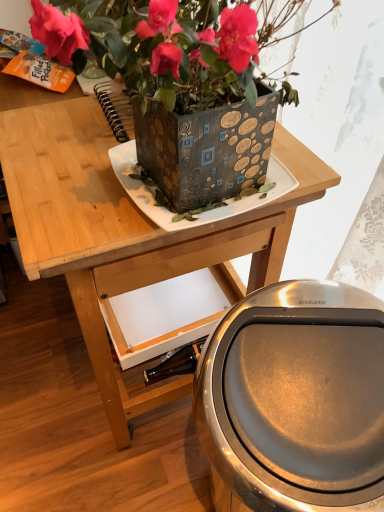
Question: Is wooden table at upper center oriented towards polished stainless steel trash can at lower right?

Choices:
 (A) no
 (B) yes

Answer: (A)

Question: Considering the relative sizes of wooden table at upper center and polished stainless steel trash can at lower right in the image provided, is wooden table at upper center wider than polished stainless steel trash can at lower right?

Choices:
 (A) no
 (B) yes

Answer: (B)

Question: Is there a large distance between wooden table at upper center and polished stainless steel trash can at lower right?

Choices:
 (A) yes
 (B) no

Answer: (B)

Question: Does wooden table at upper center come in front of polished stainless steel trash can at lower right?

Choices:
 (A) no
 (B) yes

Answer: (A)

Question: From a real-world perspective, is wooden table at upper center located higher than polished stainless steel trash can at lower right?

Choices:
 (A) yes
 (B) no

Answer: (A)

Question: In terms of width, does metallic textured planter at upper center look wider or thinner when compared to wooden table at upper center?

Choices:
 (A) thin
 (B) wide

Answer: (A)

Question: Which is correct: metallic textured planter at upper center is inside wooden table at upper center, or outside of it?

Choices:
 (A) inside
 (B) outside

Answer: (B)

Question: From a real-world perspective, is metallic textured planter at upper center physically located above or below wooden table at upper center?

Choices:
 (A) below
 (B) above

Answer: (B)

Question: Is metallic textured planter at upper center bigger or smaller than wooden table at upper center?

Choices:
 (A) small
 (B) big

Answer: (A)

Question: Does point (72, 106) appear closer or farther from the camera than point (241, 30)?

Choices:
 (A) farther
 (B) closer

Answer: (A)

Question: In terms of height, does wooden table at upper center look taller or shorter compared to metallic textured planter at upper center?

Choices:
 (A) tall
 (B) short

Answer: (A)

Question: Choose the correct answer: Is wooden table at upper center inside metallic textured planter at upper center or outside it?

Choices:
 (A) inside
 (B) outside

Answer: (B)

Question: Is wooden table at upper center in front of or behind metallic textured planter at upper center in the image?

Choices:
 (A) front
 (B) behind

Answer: (B)

Question: Would you say metallic textured planter at upper center is to the left or to the right of polished stainless steel trash can at lower right in the picture?

Choices:
 (A) right
 (B) left

Answer: (B)

Question: Is metallic textured planter at upper center in front of or behind polished stainless steel trash can at lower right in the image?

Choices:
 (A) front
 (B) behind

Answer: (A)